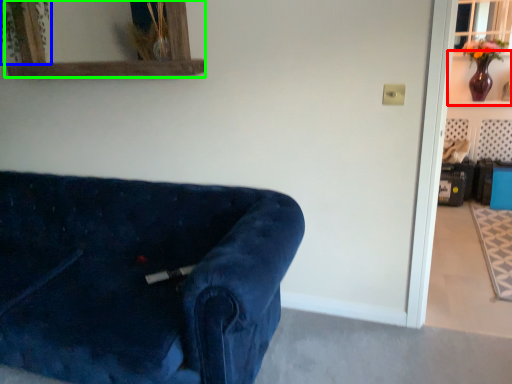
Question: Which is nearer to the shelf (highlighted by a red box)? plant (highlighted by a blue box) or mirror (highlighted by a green box).

Choices:
 (A) plant
 (B) mirror

Answer: (B)